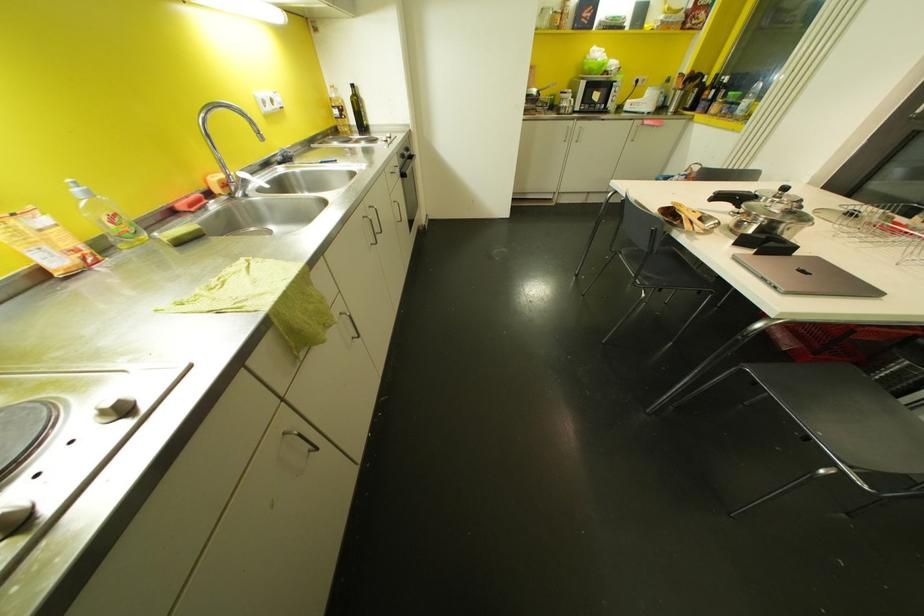
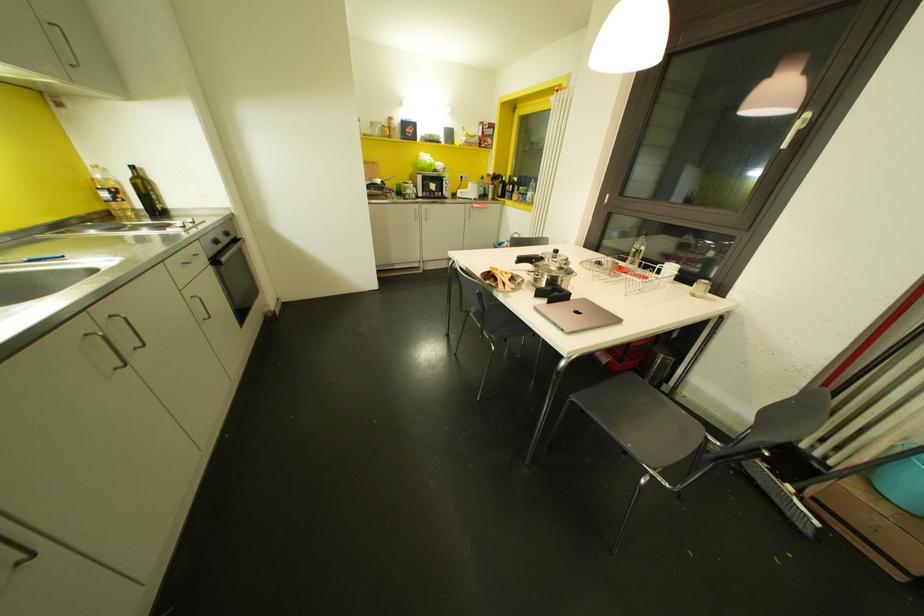
Question: In a continuous first-person perspective shot, in which direction is the camera moving?

Choices:
 (A) Left
 (B) Right
 (C) Forward
 (D) Backward

Answer: (B)